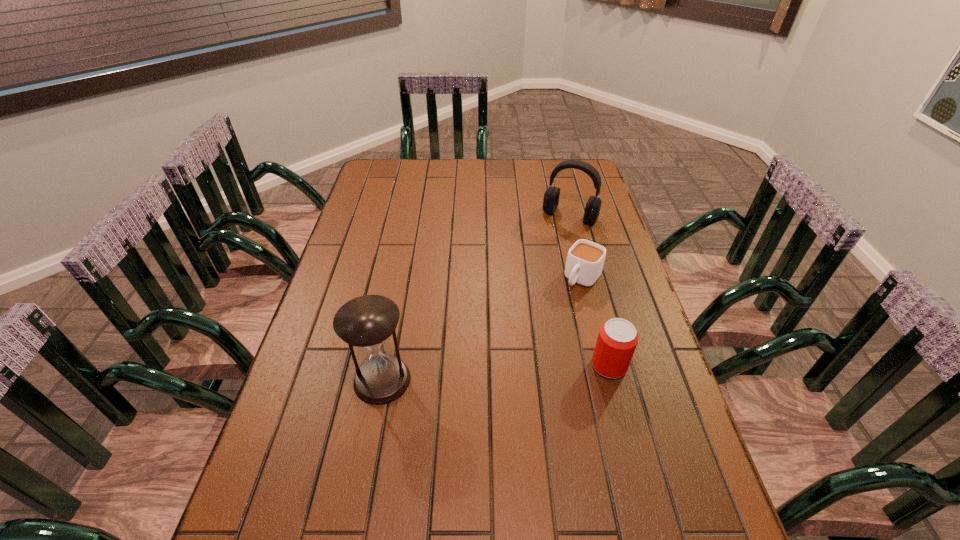
This screenshot has width=960, height=540. I want to click on the leftmost object, so click(x=367, y=322).

This screenshot has height=540, width=960. Find the location of `beer can`. beer can is located at coordinates (617, 339).

Where is `the second farthest object`? The image size is (960, 540). the second farthest object is located at coordinates (585, 259).

This screenshot has width=960, height=540. What are the coordinates of `cup` in the screenshot? It's located at (585, 259).

You are a GUI agent. You are given a task and a screenshot of the screen. Output one action in this format:
    pyautogui.click(x=<x>, y=<y>)
    Task: Click on the headset
    This screenshot has width=960, height=540.
    Given the screenshot: What is the action you would take?
    tap(551, 197)

Where is `free space located 0.200m on the front of the leftmost object`? This screenshot has height=540, width=960. free space located 0.200m on the front of the leftmost object is located at coordinates (360, 494).

Locate an element on the screen. This screenshot has height=540, width=960. free point located 0.400m on the back of the third tallest object is located at coordinates (580, 253).

Image resolution: width=960 pixels, height=540 pixels. Identify the location of vacant area located on the side with the handle of the shortest object. (512, 374).

Find the location of `free region located on the side with the handle of the shortest object`. free region located on the side with the handle of the shortest object is located at coordinates (554, 319).

Find the location of a particular element. The height and width of the screenshot is (540, 960). vacant space located 0.210m on the side with the handle of the shortest object is located at coordinates (540, 338).